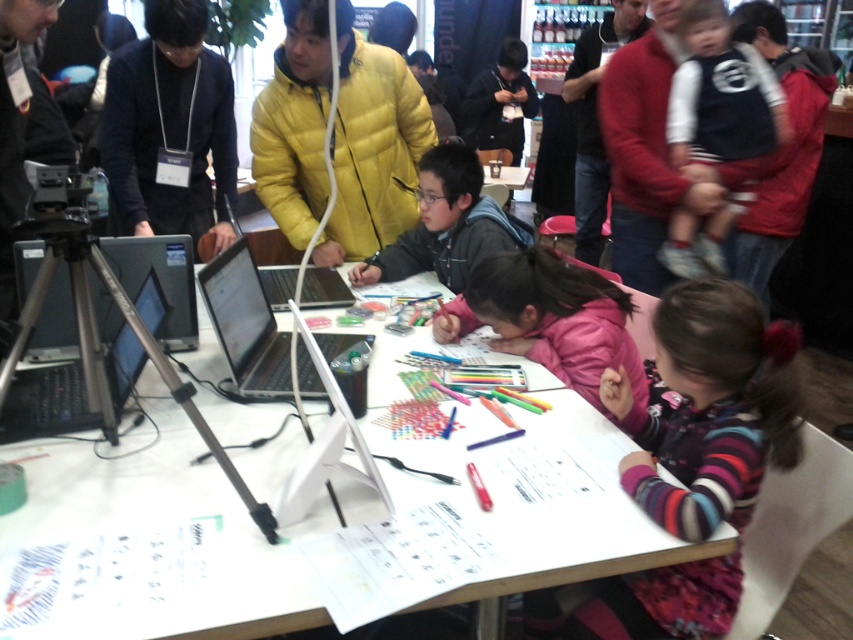
Question: Is silver/black laptop at center wider than dark blue jacket at center?

Choices:
 (A) yes
 (B) no

Answer: (B)

Question: Does white paper at center appear over dark blue jacket at center?

Choices:
 (A) yes
 (B) no

Answer: (B)

Question: Does yellow puffy jacket at center have a lesser width compared to silver/black laptop at center?

Choices:
 (A) yes
 (B) no

Answer: (B)

Question: Which point is closer to the camera taking this photo?

Choices:
 (A) (280, 269)
 (B) (321, 198)

Answer: (A)

Question: Estimate the real-world distances between objects in this image. Which object is farther from the silver/black laptop at center?

Choices:
 (A) dark blue jersey at upper right
 (B) black fabric at left

Answer: (A)

Question: Which of the following is the farthest from the observer?

Choices:
 (A) (527, 81)
 (B) (695, 138)

Answer: (A)